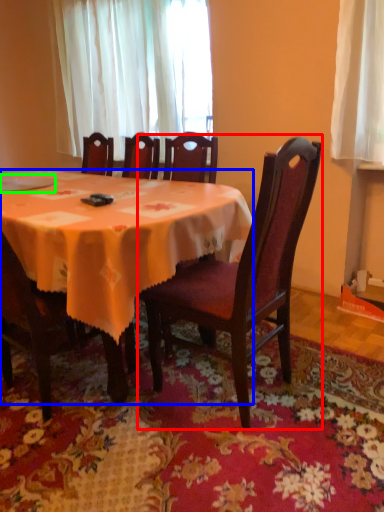
Question: Considering the real-world distances, which object is farthest from chair (highlighted by a red box)? kitchen & dining room table (highlighted by a blue box) or tableware (highlighted by a green box)?

Choices:
 (A) kitchen & dining room table
 (B) tableware

Answer: (B)